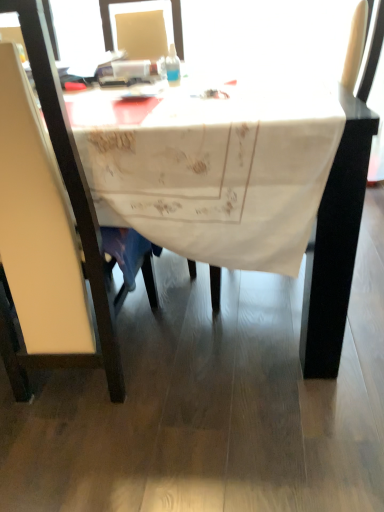
Locate an element on the screen. The width and height of the screenshot is (384, 512). white leather chair at left is located at coordinates (72, 182).

In order to click on bottle above the white leather chair at left (from a real-world perspective) in this screenshot , I will do `click(173, 66)`.

Between transparent plastic bottle at center and white leather chair at left, which one has larger size?

With larger size is white leather chair at left.

Looking at this image, can we say transparent plastic bottle at center lies outside white leather chair at left?

Yes, transparent plastic bottle at center is outside of white leather chair at left.

Is transparent plastic bottle at center looking in the opposite direction of white leather chair at left?

That's not correct — transparent plastic bottle at center is not looking away from white leather chair at left.

Is white embroidered tablecloth at center taller than transparent plastic bottle at center?

Yes.

Between white embroidered tablecloth at center and transparent plastic bottle at center, which one has larger size?

Bigger between the two is white embroidered tablecloth at center.

Is white embroidered tablecloth at center completely or partially outside of transparent plastic bottle at center?

That's correct, white embroidered tablecloth at center is outside of transparent plastic bottle at center.

Who is bigger, white embroidered tablecloth at center or white leather chair at left?

white embroidered tablecloth at center.

From a real-world perspective, between white embroidered tablecloth at center and white leather chair at left, who is vertically higher?

white leather chair at left.

Can you confirm if white embroidered tablecloth at center is taller than white leather chair at left?

No.

Could you tell me if white leather chair at left is turned towards transparent plastic bottle at center?

No, white leather chair at left is not aimed at transparent plastic bottle at center.

From the image's perspective, which is below, white leather chair at left or transparent plastic bottle at center?

white leather chair at left, from the image's perspective.

Considering the sizes of objects white leather chair at left and transparent plastic bottle at center in the image provided, who is bigger, white leather chair at left or transparent plastic bottle at center?

white leather chair at left is bigger.

In the scene shown: Is white leather chair at left wider than transparent plastic bottle at center?

Yes.

From a real-world perspective, is transparent plastic bottle at center physically located above or below white embroidered tablecloth at center?

Clearly, from a real-world perspective, transparent plastic bottle at center is above white embroidered tablecloth at center.

Between transparent plastic bottle at center and white embroidered tablecloth at center, which one is positioned in front?

Positioned in front is white embroidered tablecloth at center.

Is transparent plastic bottle at center at the left side of white embroidered tablecloth at center?

Incorrect, transparent plastic bottle at center is not on the left side of white embroidered tablecloth at center.

Which object is wider, transparent plastic bottle at center or white embroidered tablecloth at center?

white embroidered tablecloth at center.

Is white leather chair at left not near white embroidered tablecloth at center?

No, there isn't a large distance between white leather chair at left and white embroidered tablecloth at center.

Considering the sizes of objects white leather chair at left and white embroidered tablecloth at center in the image provided, who is thinner, white leather chair at left or white embroidered tablecloth at center?

white leather chair at left is thinner.

Is white leather chair at left positioned in front of white embroidered tablecloth at center?

Yes, it is in front of white embroidered tablecloth at center.

Based on the photo, from the image's perspective, who appears lower, white leather chair at left or white embroidered tablecloth at center?

white leather chair at left is shown below in the image.

Find the location of a particular element. This screenshot has height=512, width=384. chair that is on the left side of transparent plastic bottle at center is located at coordinates (72, 182).

I want to click on bottle above the white embroidered tablecloth at center (from a real-world perspective), so click(173, 66).

Which object lies nearer to the anchor point transparent plastic bottle at center, white embroidered tablecloth at center or white leather chair at left?

white embroidered tablecloth at center is closer to transparent plastic bottle at center.

Looking at the image, which one is located closer to white leather chair at left, transparent plastic bottle at center or white embroidered tablecloth at center?

white embroidered tablecloth at center is closer to white leather chair at left.

Considering their positions, is white embroidered tablecloth at center positioned closer to white leather chair at left than transparent plastic bottle at center?

Among the two, white embroidered tablecloth at center is located nearer to white leather chair at left.

Which object lies further to the anchor point white embroidered tablecloth at center, transparent plastic bottle at center or white leather chair at left?

transparent plastic bottle at center.

Estimate the real-world distances between objects in this image. Which object is further from white embroidered tablecloth at center, white leather chair at left or transparent plastic bottle at center?

transparent plastic bottle at center is positioned further to the anchor white embroidered tablecloth at center.

From the image, which object appears to be farther from transparent plastic bottle at center, white leather chair at left or white embroidered tablecloth at center?

white leather chair at left.

Where is `tablecloth located between white leather chair at left and transparent plastic bottle at center in the depth direction`? Image resolution: width=384 pixels, height=512 pixels. tablecloth located between white leather chair at left and transparent plastic bottle at center in the depth direction is located at coordinates (214, 168).